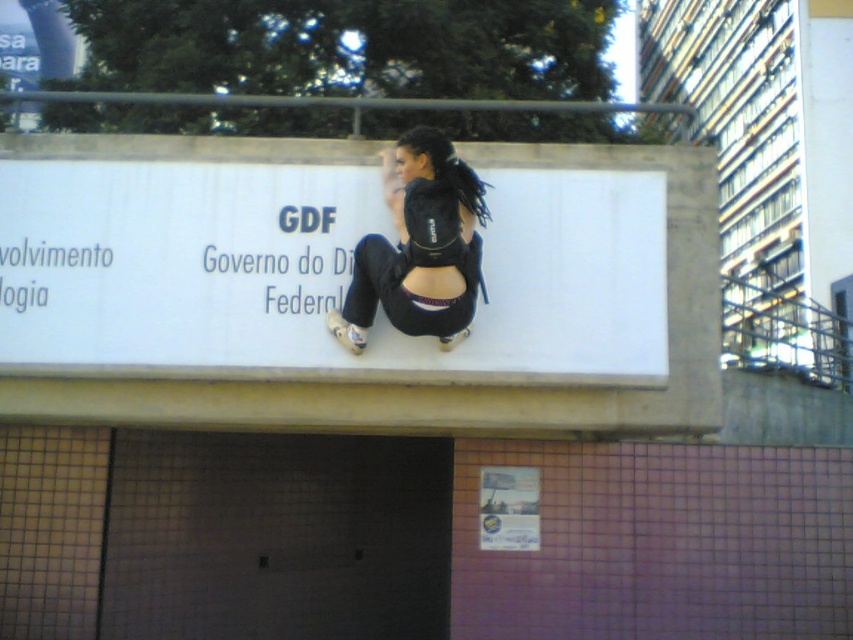
Who is shorter, white matte billboard at center or black fabric backpack at center?

black fabric backpack at center

Can you confirm if white matte billboard at center is positioned to the right of black fabric backpack at center?

Incorrect, white matte billboard at center is not on the right side of black fabric backpack at center.

Measure the distance between point (9, 221) and camera.

A distance of 5.43 meters exists between point (9, 221) and camera.

Identify the location of white matte billboard at center. (316, 273).